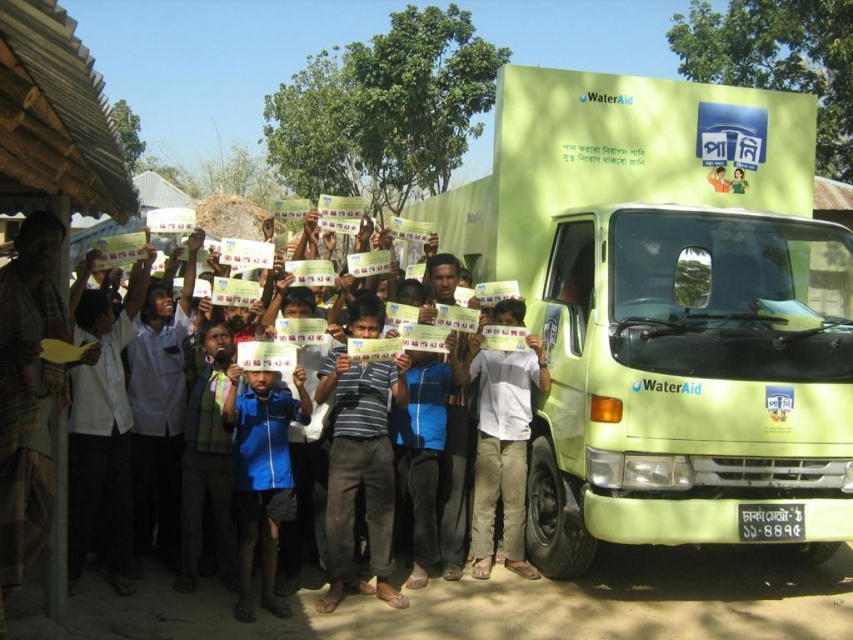
You are standing at the center of the image and see a point marked at coordinates (502,451). What object is located at that point?

The point at coordinates (502,451) marks the location of the light blue shirt at center.

You are a photographer at the event and want to take a photo that includes both the green matte truck at center and the light blue shirt at center. Based on their positions, which object should you focus on first to ensure both are in frame?

The green matte truck at center is above the light blue shirt at center, so you should focus on the green matte truck at center first to ensure both are in frame.